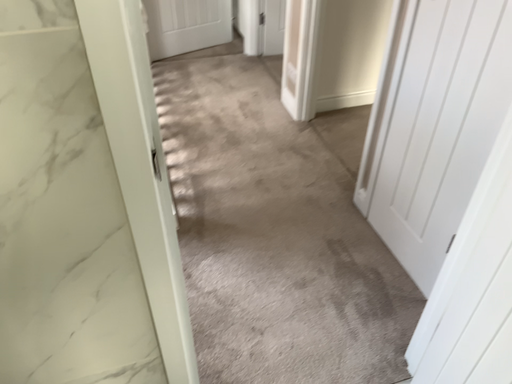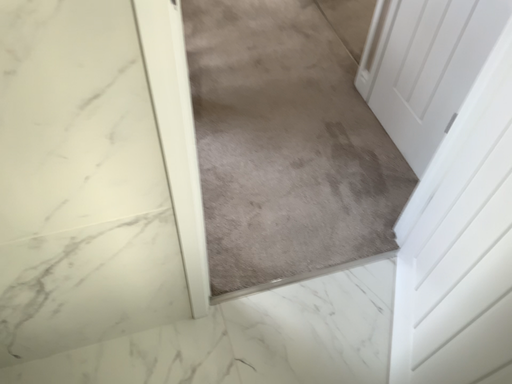
Question: Which way did the camera rotate in the video?

Choices:
 (A) rotated upward
 (B) rotated downward

Answer: (B)